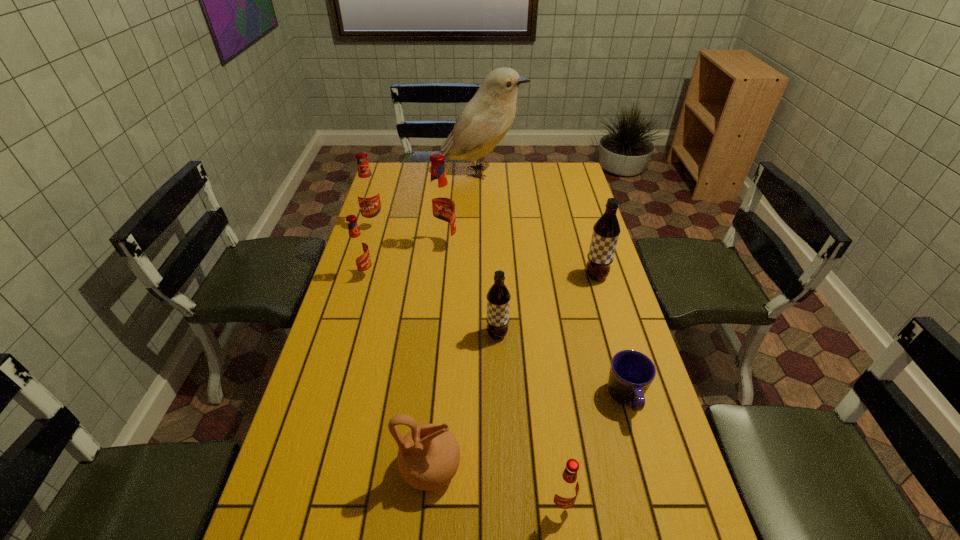
Locate which object ranks fifth in proximity to the second root beer from right to left. Please provide its 2D coordinates. Your answer should be formatted as a tuple, i.e. [(x, y)], where the tuple contains the x and y coordinates of a point satisfying the conditions above.

[(357, 247)]

Choose which object is the nearest neighbor to the parakeet. Please provide its 2D coordinates. Your answer should be formatted as a tuple, i.e. [(x, y)], where the tuple contains the x and y coordinates of a point satisfying the conditions above.

[(368, 194)]

Point out which root beer is positioned as the fifth nearest to the rightmost root beer. Please provide its 2D coordinates. Your answer should be formatted as a tuple, i.e. [(x, y)], where the tuple contains the x and y coordinates of a point satisfying the conditions above.

[(368, 194)]

Choose which root beer is the nearest neighbor to the nearest root beer. Please provide its 2D coordinates. Your answer should be formatted as a tuple, i.e. [(x, y)], where the tuple contains the x and y coordinates of a point satisfying the conditions above.

[(498, 297)]

Find the location of a particular element. The height and width of the screenshot is (540, 960). the fourth closest red root beer to the tallest object is located at coordinates (566, 487).

At what (x,y) coordinates should I click in order to perform the action: click on red root beer that can be found as the third closest to the fifth farthest root beer. Please return your answer as a coordinate pair (x, y). The height and width of the screenshot is (540, 960). Looking at the image, I should click on (566, 487).

At what (x,y) coordinates should I click in order to perform the action: click on brown root beer identified as the second closest to the farthest red root beer. Please return your answer as a coordinate pair (x, y). Looking at the image, I should click on (606, 230).

I want to click on free space that satisfies the following two spatial constraints: 1. on the spout of the shortest root beer; 2. on the left side of the pottery, so click(428, 504).

Locate an element on the screen. This screenshot has width=960, height=540. free space that satisfies the following two spatial constraints: 1. on the back side of the rightmost root beer; 2. on the face of the farthest object is located at coordinates (565, 172).